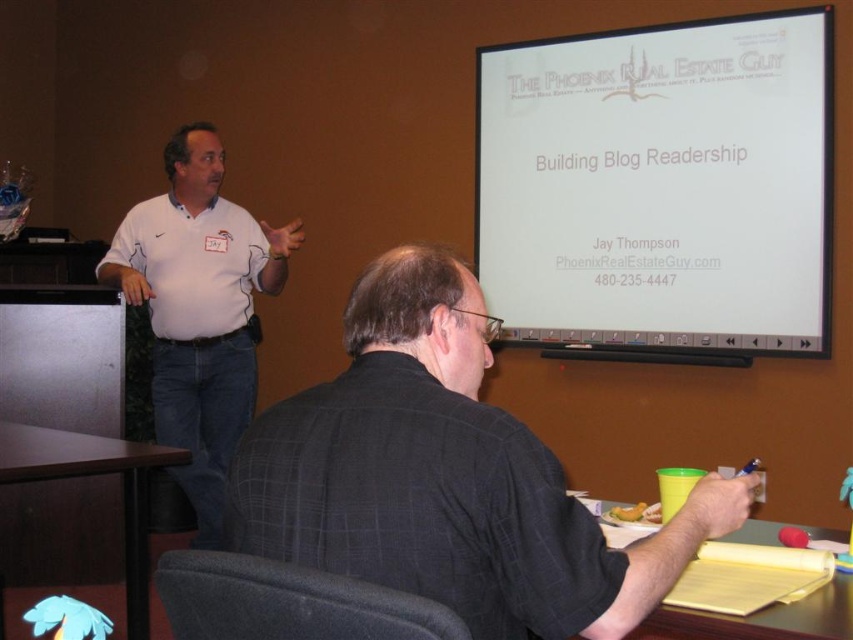
Question: Is dark gray checkered shirt at center smaller than white shirt at left?

Choices:
 (A) no
 (B) yes

Answer: (B)

Question: Where is white shirt at left located in relation to yellow paper at lower right in the image?

Choices:
 (A) above
 (B) below

Answer: (A)

Question: Which of the following is the farthest from the observer?

Choices:
 (A) (810, 621)
 (B) (306, 541)
 (C) (134, 620)
 (D) (612, 298)

Answer: (D)

Question: Which point is closer to the camera?

Choices:
 (A) (144, 561)
 (B) (645, 531)
 (C) (538, 154)
 (D) (407, 388)

Answer: (D)

Question: Among these objects, which one is nearest to the camera?

Choices:
 (A) white matte projection screen at upper center
 (B) dark gray checkered shirt at center
 (C) yellow paper at lower right
 (D) white shirt at left

Answer: (B)

Question: Is white matte projection screen at upper center bigger than yellow paper at lower right?

Choices:
 (A) yes
 (B) no

Answer: (A)